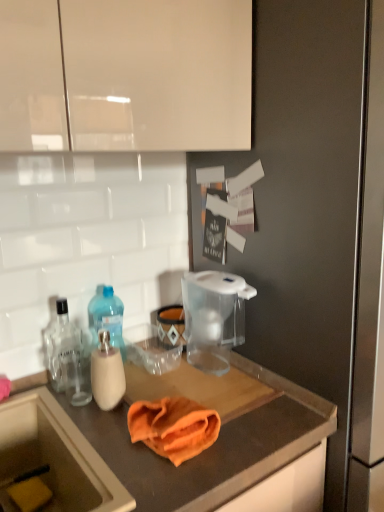
Where is `blank space to the left of transparent plastic water filter pitcher at center`? The height and width of the screenshot is (512, 384). blank space to the left of transparent plastic water filter pitcher at center is located at coordinates (162, 376).